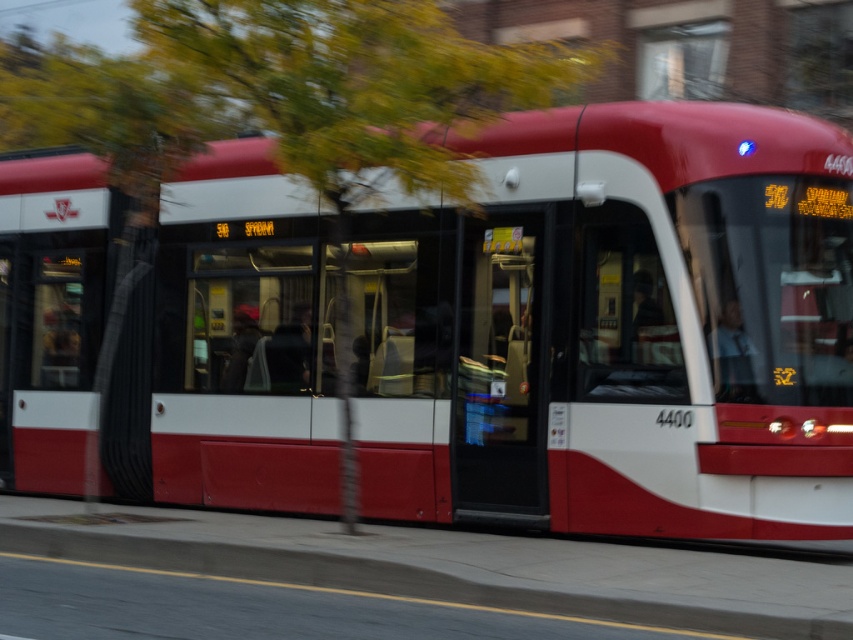
Question: Which point is farther from the camera taking this photo?

Choices:
 (A) (102, 408)
 (B) (735, 589)
 (C) (309, 212)

Answer: (A)

Question: Where is matte red bus at center located in relation to concrete at lower left in the image?

Choices:
 (A) right
 (B) left

Answer: (B)

Question: Observing the image, what is the correct spatial positioning of green leafy tree at upper left in reference to concrete at lower left?

Choices:
 (A) left
 (B) right

Answer: (A)

Question: Which is farther from the green leafy tree at upper left?

Choices:
 (A) matte red bus at center
 (B) concrete at lower left

Answer: (B)

Question: Observing the image, what is the correct spatial positioning of matte red bus at center in reference to green leafy tree at upper left?

Choices:
 (A) left
 (B) right

Answer: (A)

Question: Which point is closer to the camera?

Choices:
 (A) matte red bus at center
 (B) green leafy tree at upper left
 (C) concrete at lower left

Answer: (B)